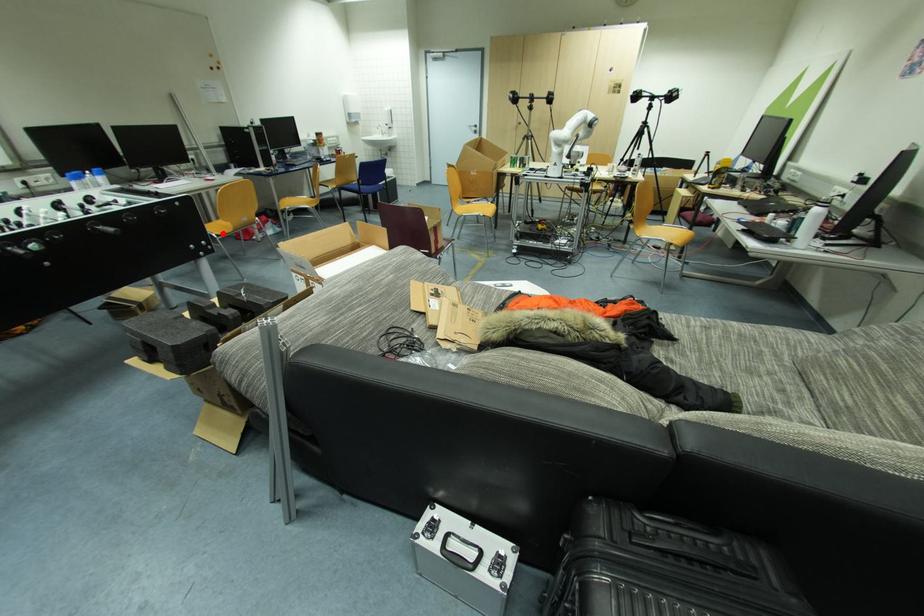
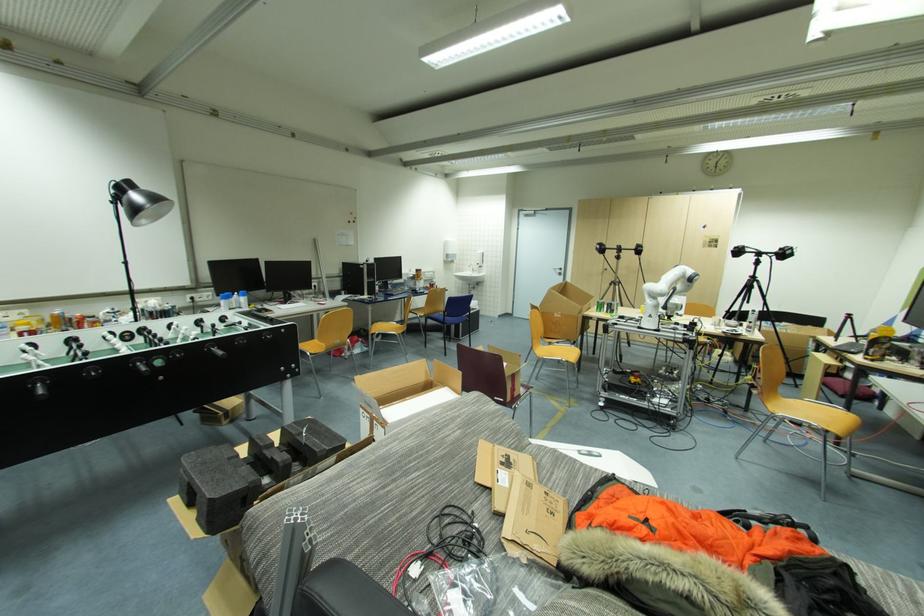
Question: I am providing you with two images of the same scene from different viewpoints. Given a red point in image1, look at the same physical point in image2. Is it:

Choices:
 (A) Closer to the viewpoint
 (B) Farther from the viewpoint

Answer: (B)